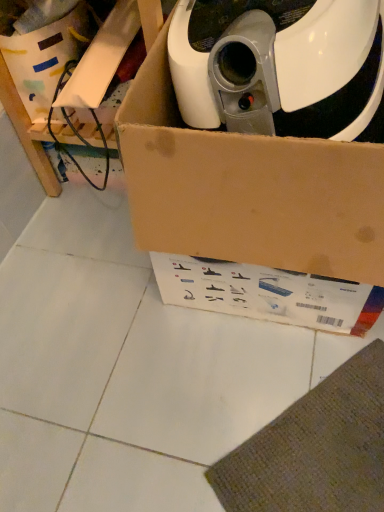
Question: Is brown cardboard box at upper left bigger or smaller than brown cardboard box at upper center?

Choices:
 (A) small
 (B) big

Answer: (B)

Question: Is brown cardboard box at upper left situated inside brown cardboard box at upper center or outside?

Choices:
 (A) outside
 (B) inside

Answer: (A)

Question: Based on their relative distances, which object is farther from the brown cardboard box at upper left?

Choices:
 (A) white cardboard box at upper left
 (B) brown cardboard box at upper center

Answer: (B)

Question: Estimate the real-world distances between objects in this image. Which object is closer to the brown cardboard box at upper left?

Choices:
 (A) white cardboard box at upper left
 (B) brown cardboard box at upper center

Answer: (A)